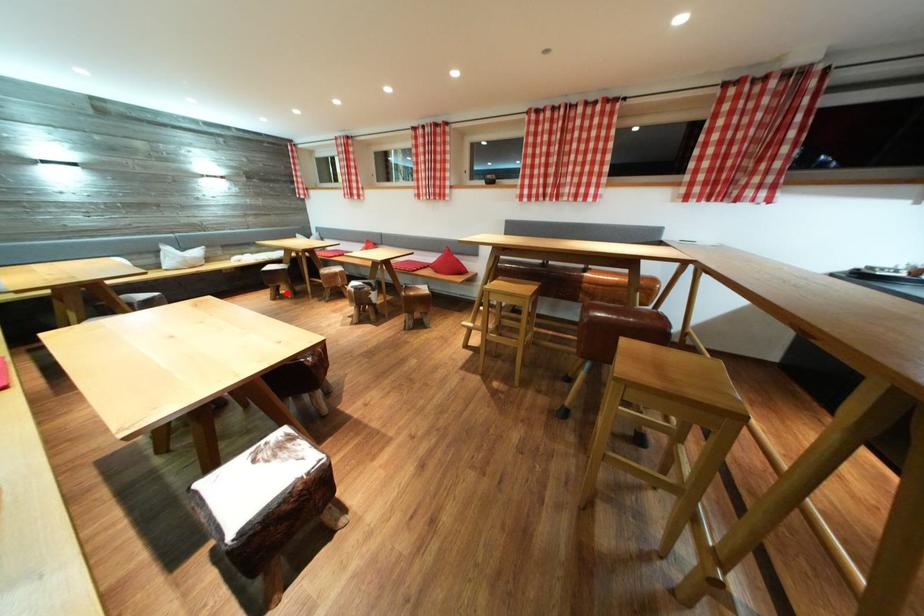
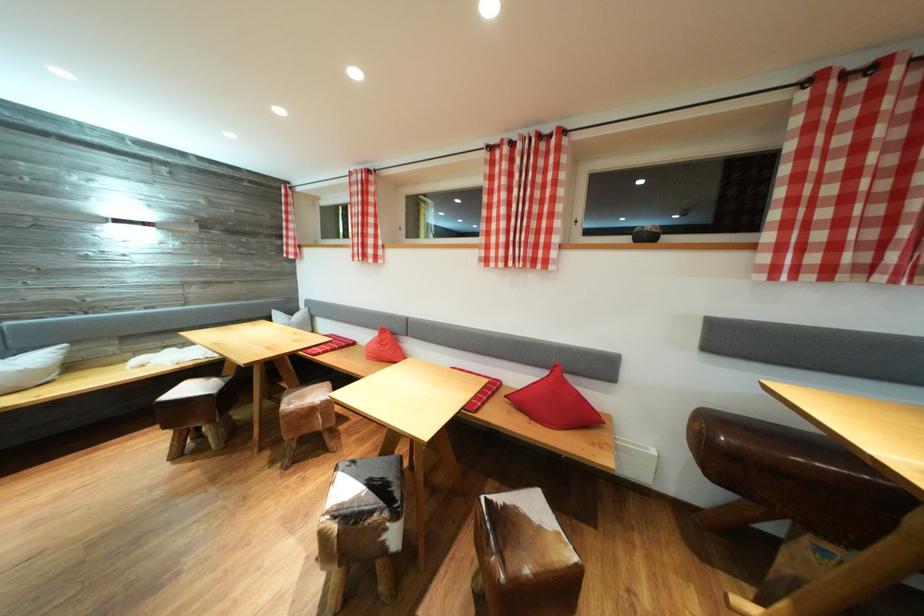
Find the pixel in the second image that matches the highlighted location in the first image.

(203, 434)